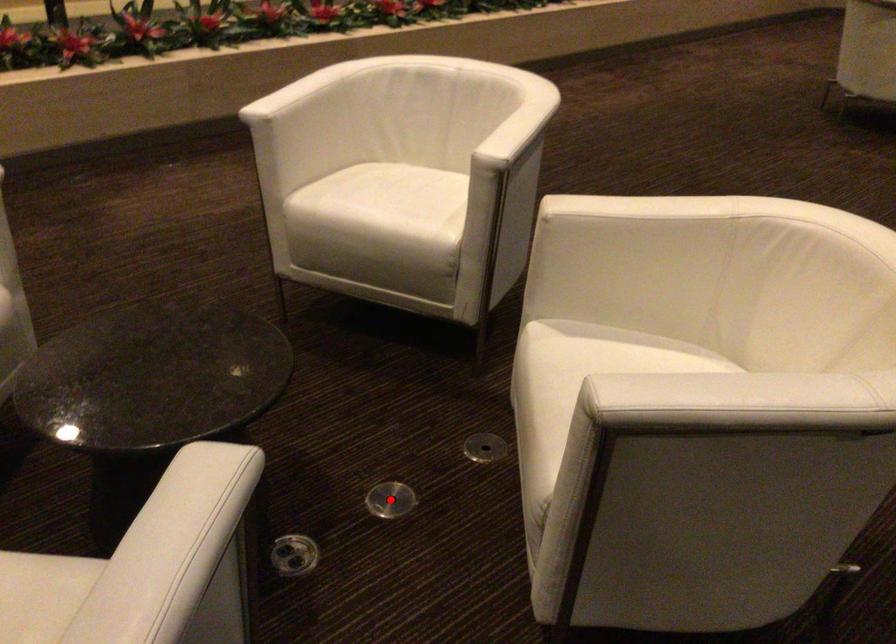
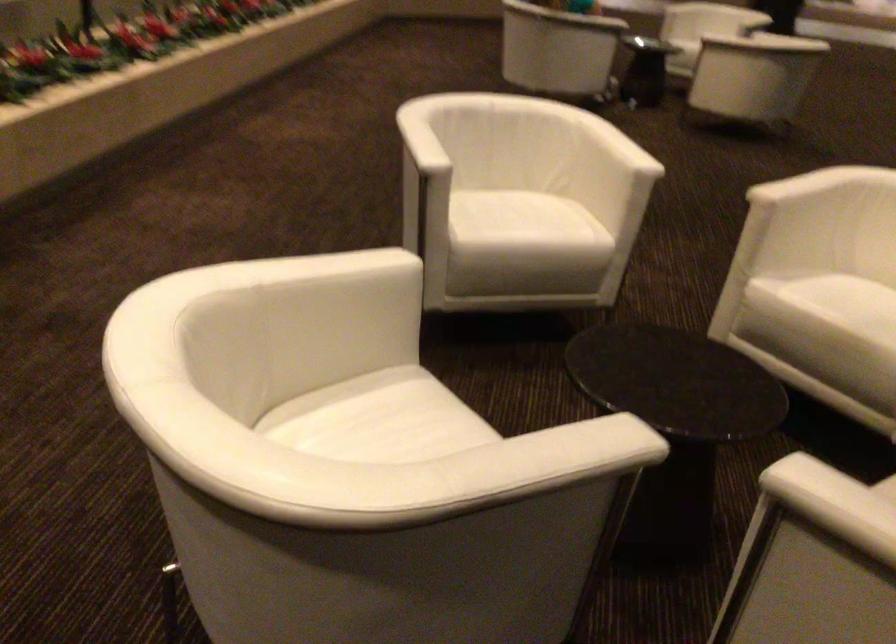
Question: I am providing you with two images of the same scene from different viewpoints. A red point is marked on the first image. At the location where the point appears in image 1, is it still visible in image 2?

Choices:
 (A) Yes
 (B) No

Answer: (B)